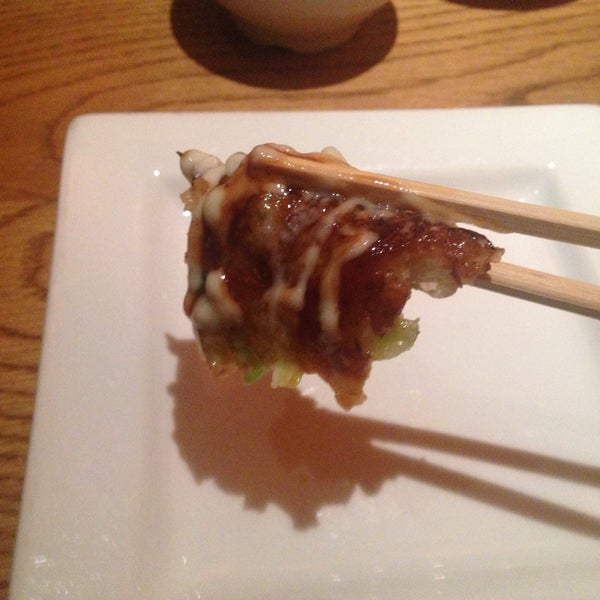
Locate an element on the screen. bottom chopstick is located at coordinates (529, 280).